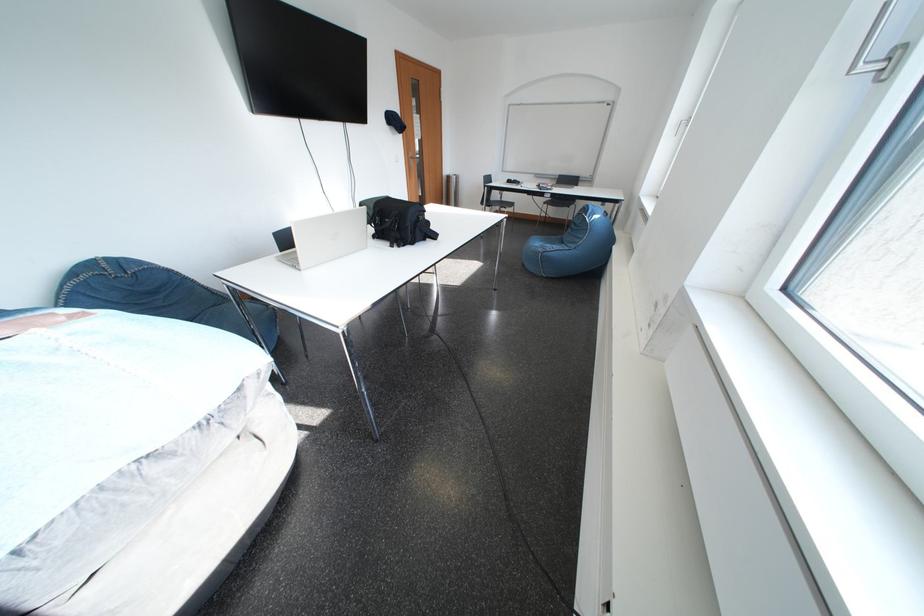
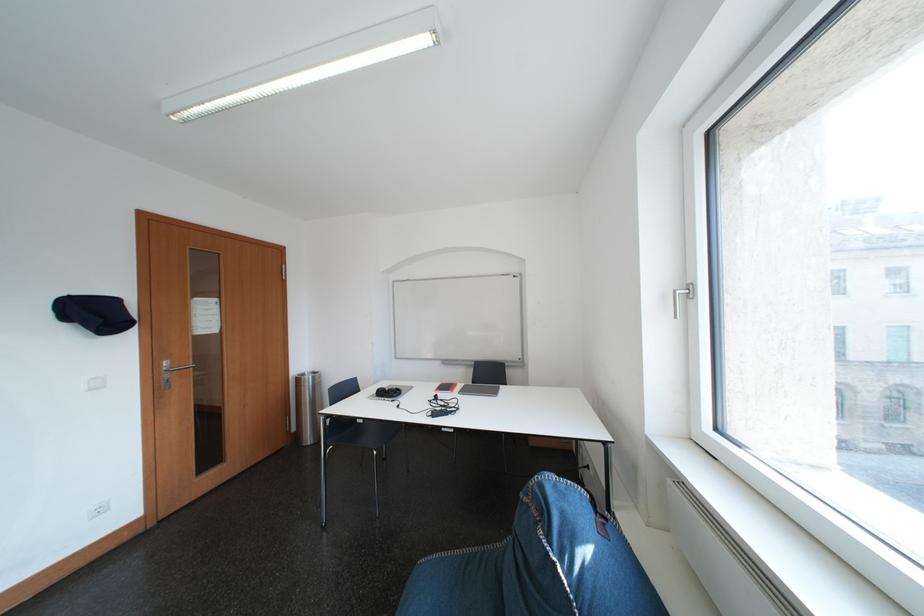
Find the pixel in the second image that matches [520,185] in the first image.

(393, 395)